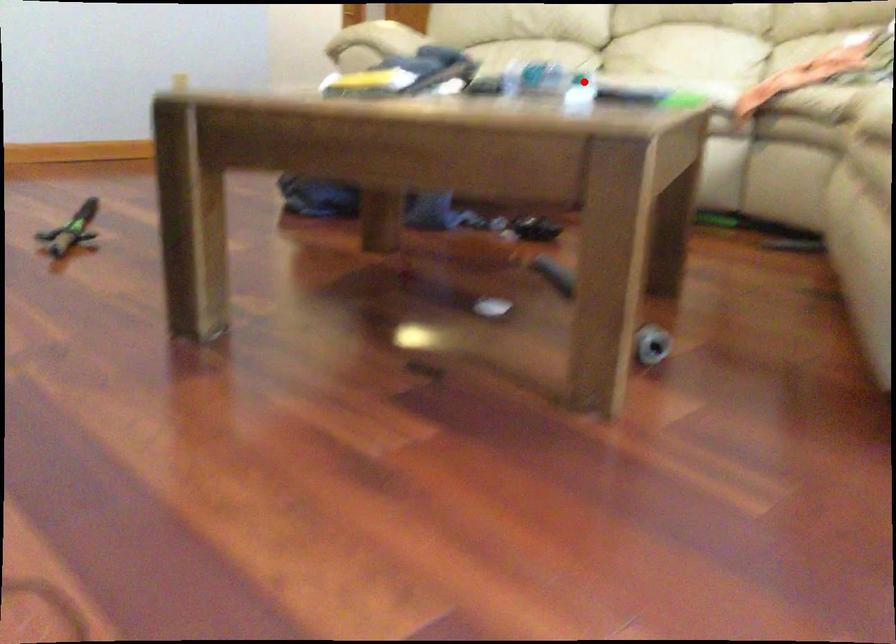
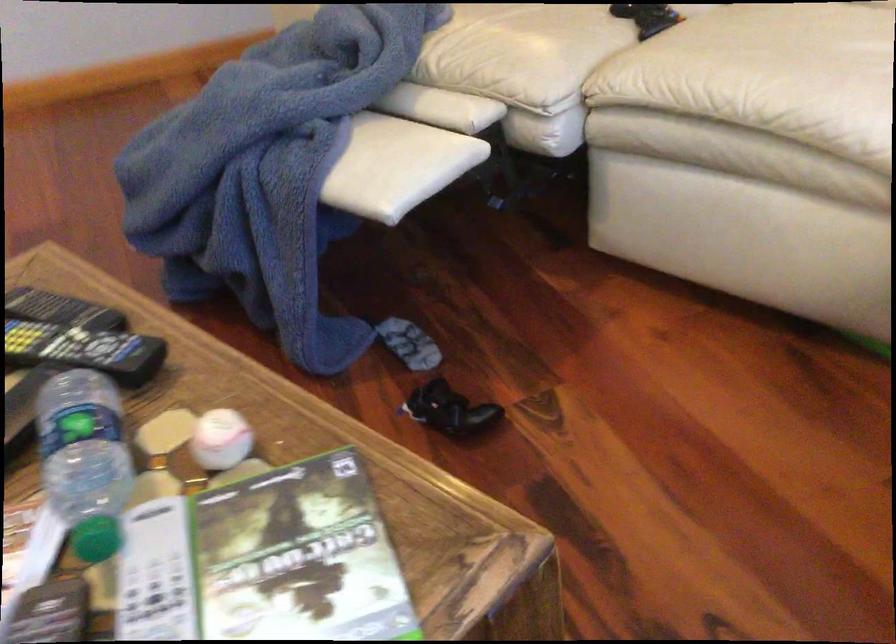
Find the pixel in the second image that matches the highlighted location in the first image.

(220, 439)